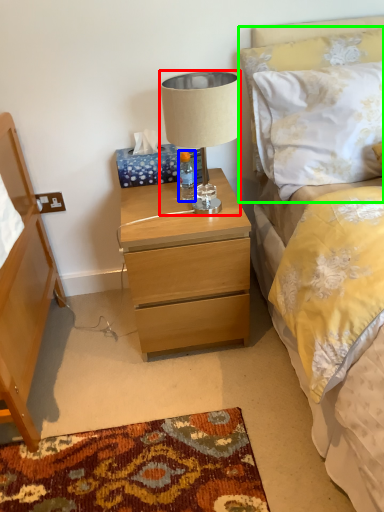
Question: Which object is the closest to the lamp (highlighted by a red box)? Choose among these: bottle (highlighted by a blue box) or pillow (highlighted by a green box).

Choices:
 (A) bottle
 (B) pillow

Answer: (B)